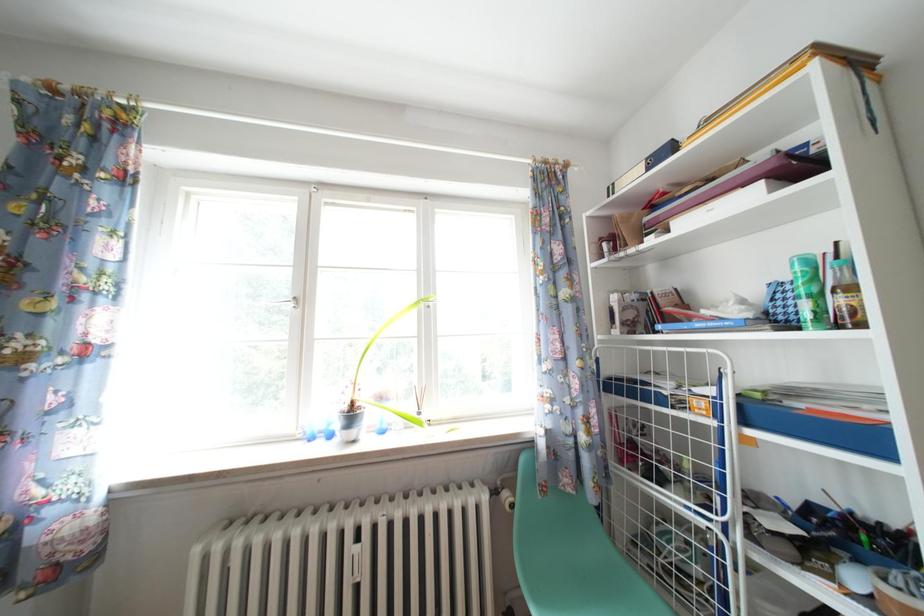
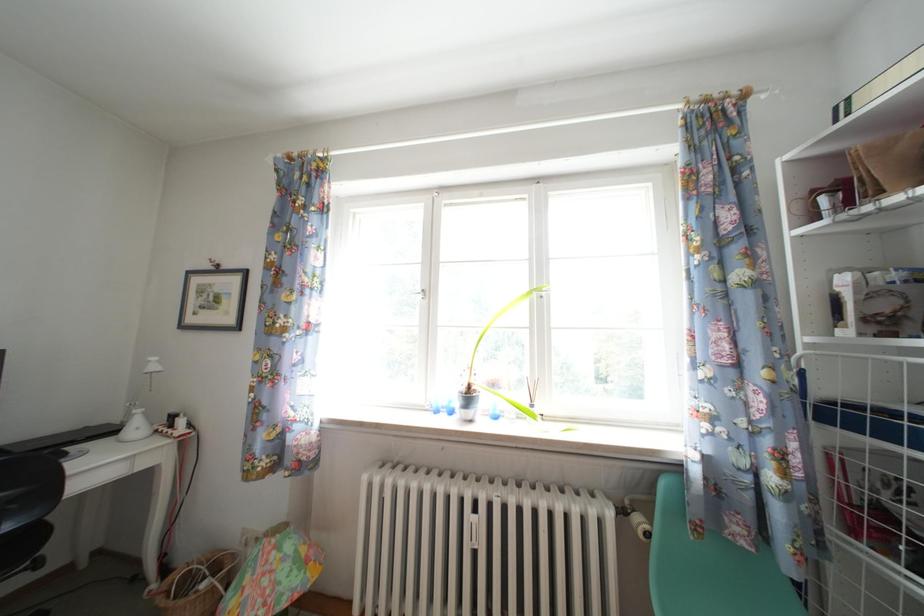
Question: The camera is either moving clockwise (left) or counter-clockwise (right) around the object. The first image is from the beginning of the video and the second image is from the end. Is the camera moving left or right when shooting the video?

Choices:
 (A) Left
 (B) Right

Answer: (B)